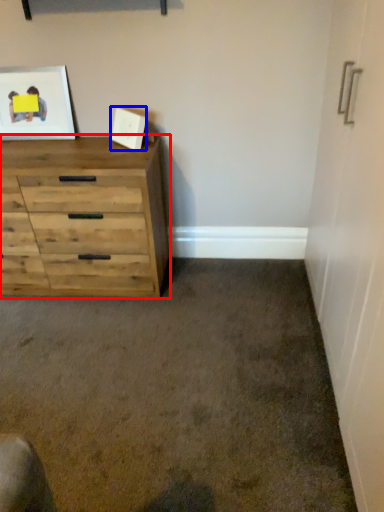
Question: Which object appears closest to the camera in this image, chest of drawers (highlighted by a red box) or picture frame (highlighted by a blue box)?

Choices:
 (A) chest of drawers
 (B) picture frame

Answer: (A)